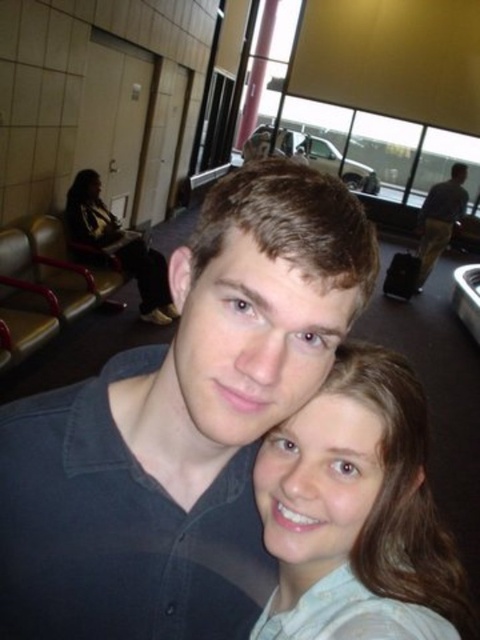
You are an airport security agent checking the height requirements for a restricted area. The minimum height to enter is 1.6 meters. You observe two individuals in the scene wearing a dark blue shirt at center and a smooth beige shirt at center. Which individual meets the height requirement?

The dark blue shirt at center is taller than the smooth beige shirt at center, so the individual wearing the dark blue shirt at center likely meets the height requirement of 1.6 meters.

You are a photographer trying to capture a closeup of the dark blue shirt at center. The camera you are using has a focal length of 50mm. To ensure the subject fills the frame, you need to know the distance between the camera and the dark blue shirt at center. The point at coordinates point (181, 426) is located on the dark blue shirt at center. Can you determine the distance required?

The point at coordinates point (181, 426) is on the dark blue shirt at center, so the distance required would depend on the camera sensor size and desired framing. However, without additional information about sensor dimensions or subject size, an exact distance cannot be calculated.

You are an airport staff member and you need to locate the dark blue shirt at center and the matte black jacket at left. From your current position, which one is lower in the image?

The dark blue shirt at center is below matte black jacket at left, so the dark blue shirt at center is lower in the image.